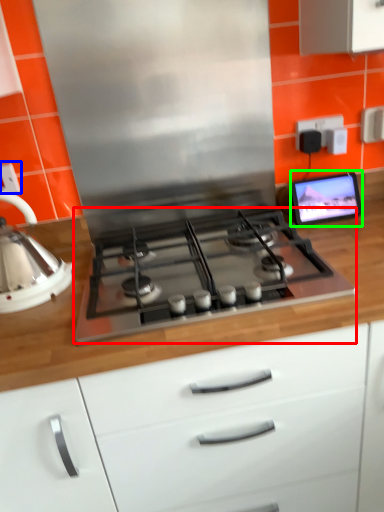
Question: Based on their relative distances, which object is nearer to gas stove (highlighted by a red box)? Choose from electric outlet (highlighted by a blue box) and computer monitor (highlighted by a green box).

Choices:
 (A) electric outlet
 (B) computer monitor

Answer: (B)